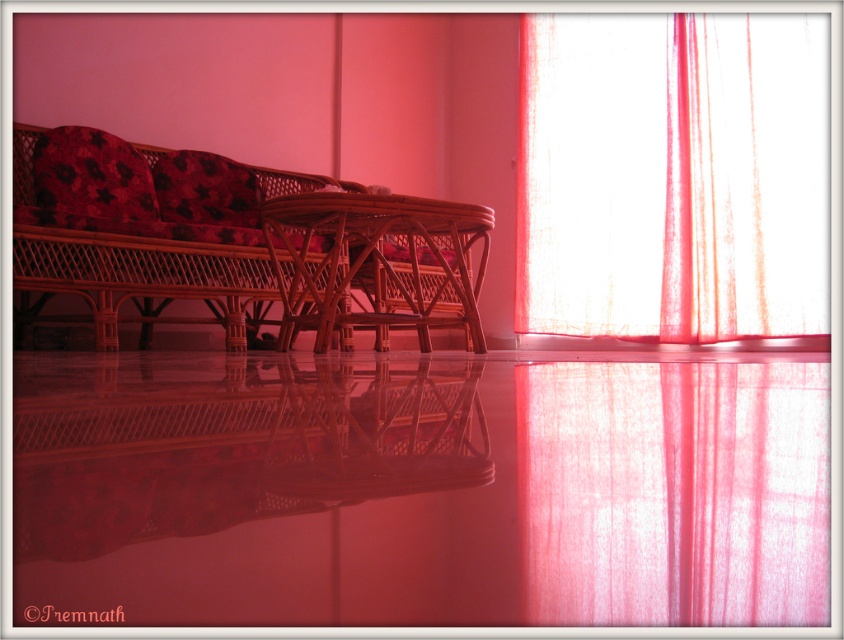
You are planning to place a small decorative item on the woven wood armchair at center and the floral fabric pillow at upper left. Considering their sizes, which one can accommodate the item more comfortably?

The woven wood armchair at center has a larger width than the floral fabric pillow at upper left, so it can accommodate the small decorative item more comfortably.

You are standing in the center of the room and want to adjust the sheer white curtain at right. Based on the coordinates provided, in which direction should you move to reach the curtain?

The sheer white curtain at right is located at point 0.770 on the x and 0.799 on the y. Since you are in the center, you should move towards the right and slightly forward to reach it.

You are sitting on the woven wood armchair at center and want to reach the floral fabric pillow at upper left. Can you grab it without moving your feet?

The woven wood armchair at center is below the floral fabric pillow at upper left, so you can reach it without moving your feet as long as your arms can stretch upwards to the pillow.